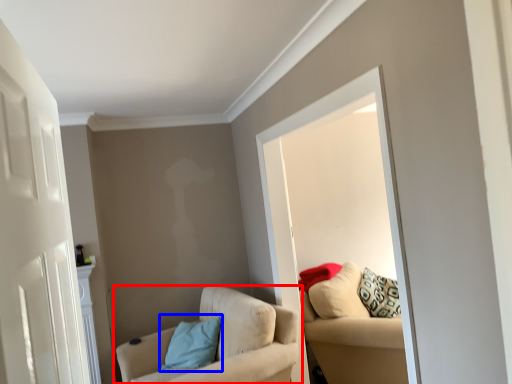
Question: Which object is closer to the camera taking this photo, chair (highlighted by a red box) or pillow (highlighted by a blue box)?

Choices:
 (A) chair
 (B) pillow

Answer: (A)